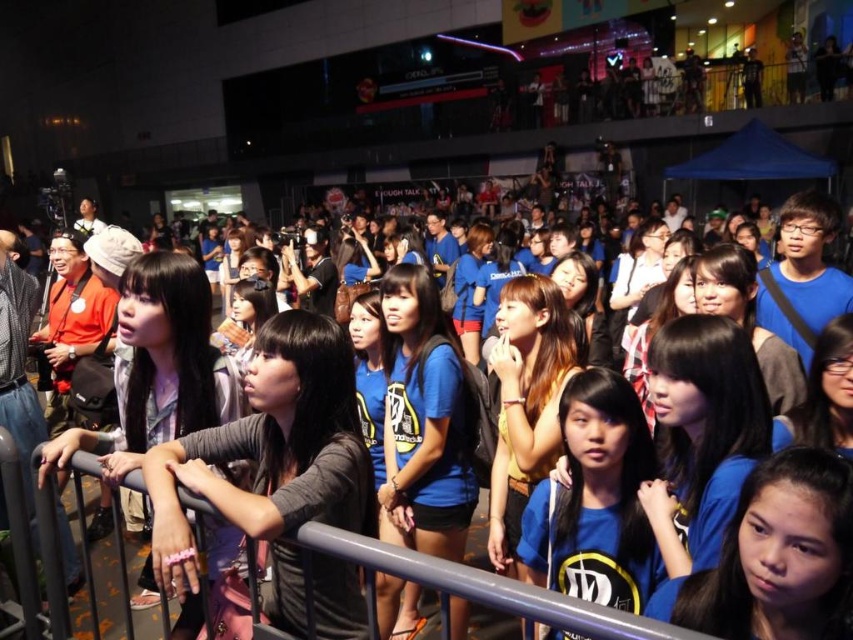
Can you confirm if blue fabric crowd at center is taller than gray metallic rail at center?

Yes.

Does blue fabric crowd at center have a smaller size compared to gray metallic rail at center?

Yes, blue fabric crowd at center is smaller than gray metallic rail at center.

Which is behind, point (28, 596) or point (364, 563)?

The point (28, 596) is more distant.

I want to click on blue fabric crowd at center, so click(476, 586).